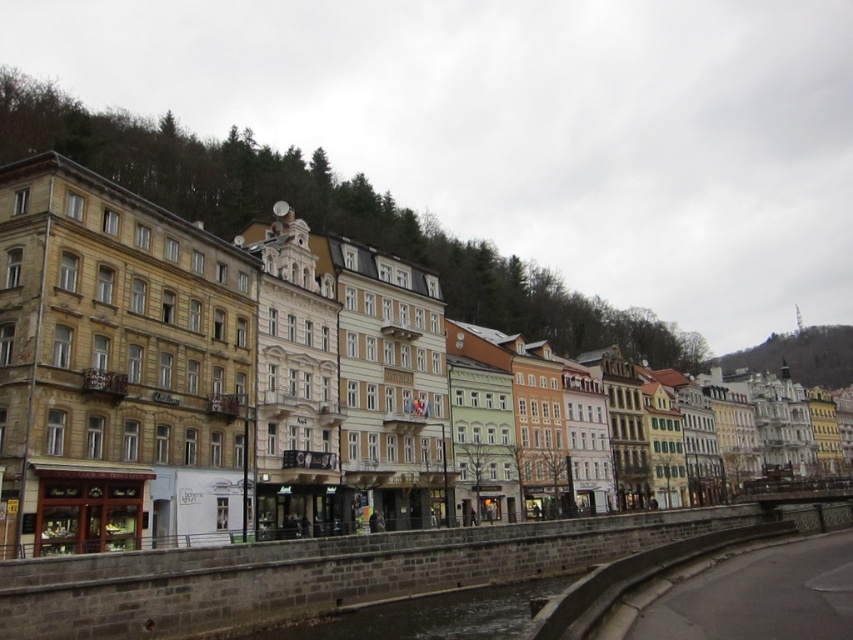
You are standing at the point labeled point (x=80, y=403) and want to walk to the point labeled point 0.505, 0.180. The path between them is a straight line. If your walking speed is 3 feet per second, how many seconds will it take you to reach the destination?

The distance between the two points is 152.74 feet. At a speed of 3 feet per second, the time required is 152.74 divided by 3, which equals approximately 50.91 seconds. So, it will take about 51 seconds to reach the destination.

You are standing at the riverbank and want to take a photo of the beige stone buildings at center and the brown stone waterway at lower center. Which one should you point your camera towards first if you want to capture both in the frame?

You should point your camera towards the brown stone waterway at lower center first because the beige stone buildings at center are to the right of it, so capturing the waterway first will allow both to be in the frame.

You are a tourist standing at the riverside in this European city. You see the beige stone buildings at center and the brown stone waterway at lower center. Which one is positioned higher in the scene?

The beige stone buildings at center are positioned higher than the brown stone waterway at lower center.